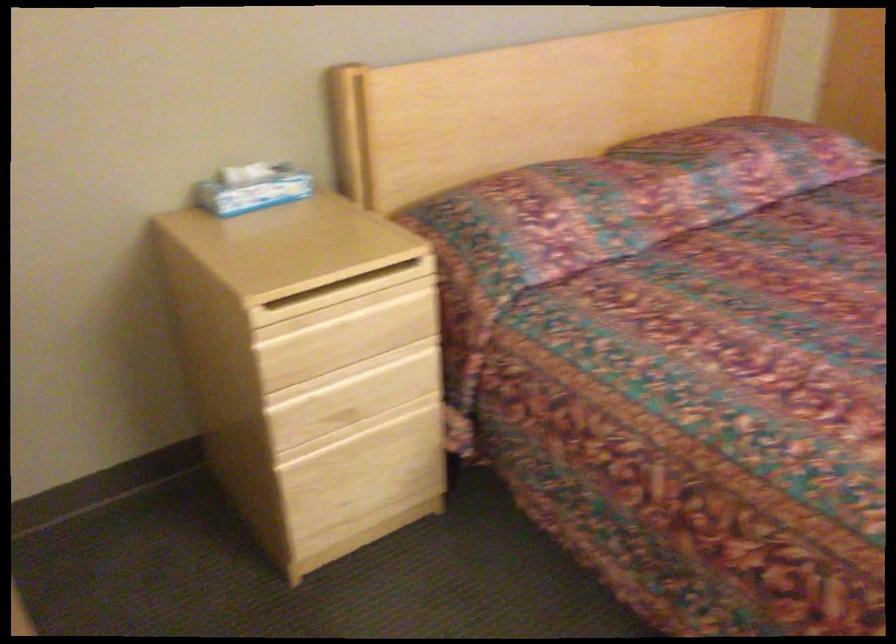
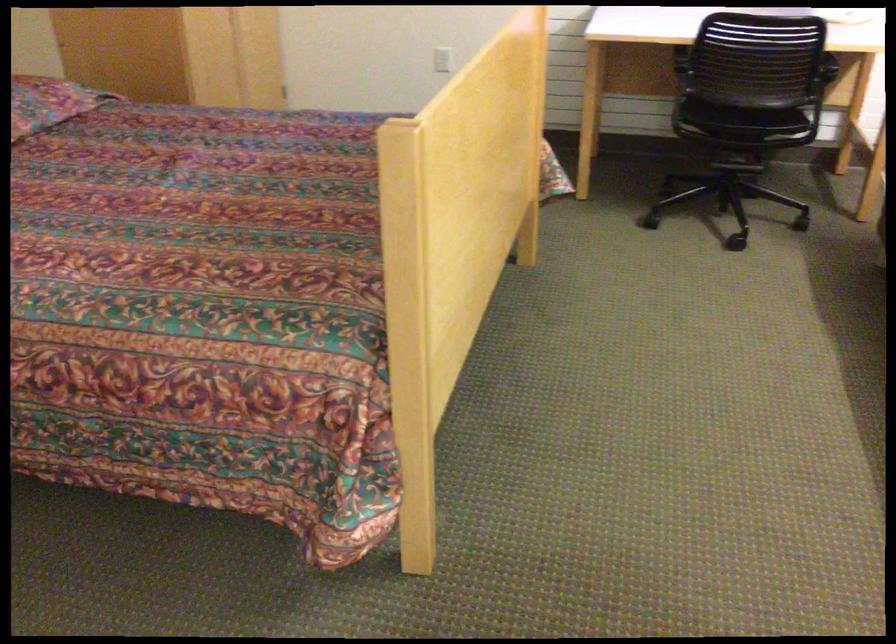
Question: The images are taken continuously from a first-person perspective. In which direction is your viewpoint rotating?

Choices:
 (A) Left
 (B) Right
 (C) Up
 (D) Down

Answer: (B)